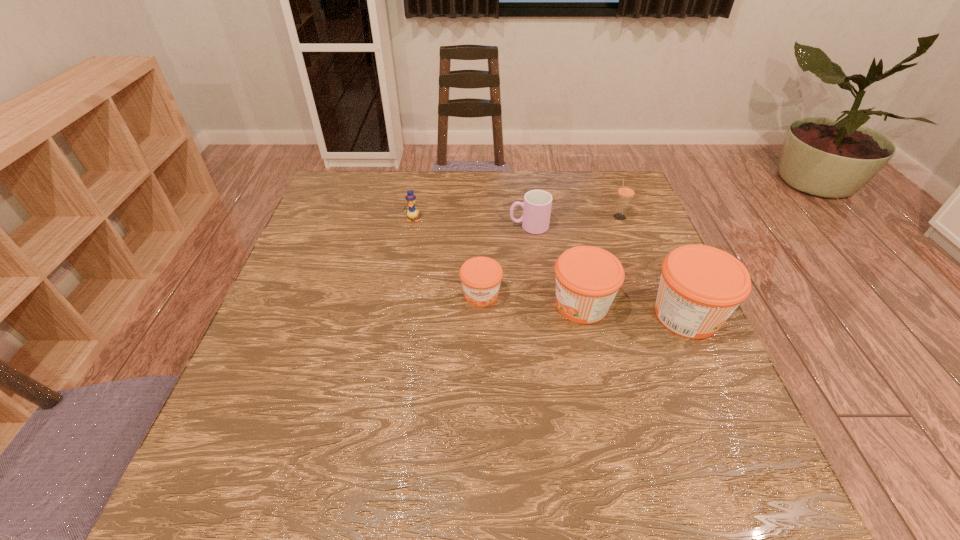
The width and height of the screenshot is (960, 540). I want to click on free point that keeps the jams evenly spaced on the left, so click(385, 285).